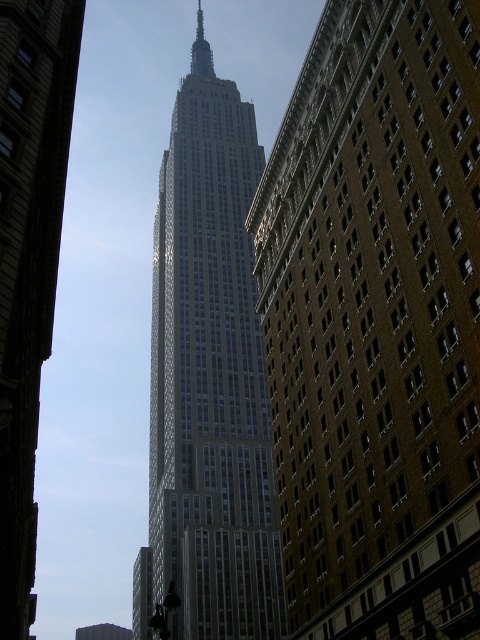
Question: Among these points, which one is nearest to the camera?

Choices:
 (A) (292, 106)
 (B) (177, 611)

Answer: (A)

Question: Does brick building at center have a larger size compared to glassy steel skyscraper at center?

Choices:
 (A) yes
 (B) no

Answer: (B)

Question: Does brick building at center have a lesser width compared to glassy steel skyscraper at center?

Choices:
 (A) no
 (B) yes

Answer: (B)

Question: Can you confirm if brick building at center is smaller than glassy steel skyscraper at center?

Choices:
 (A) yes
 (B) no

Answer: (A)

Question: Which of the following is the farthest from the observer?

Choices:
 (A) brick building at center
 (B) glassy steel skyscraper at center

Answer: (A)